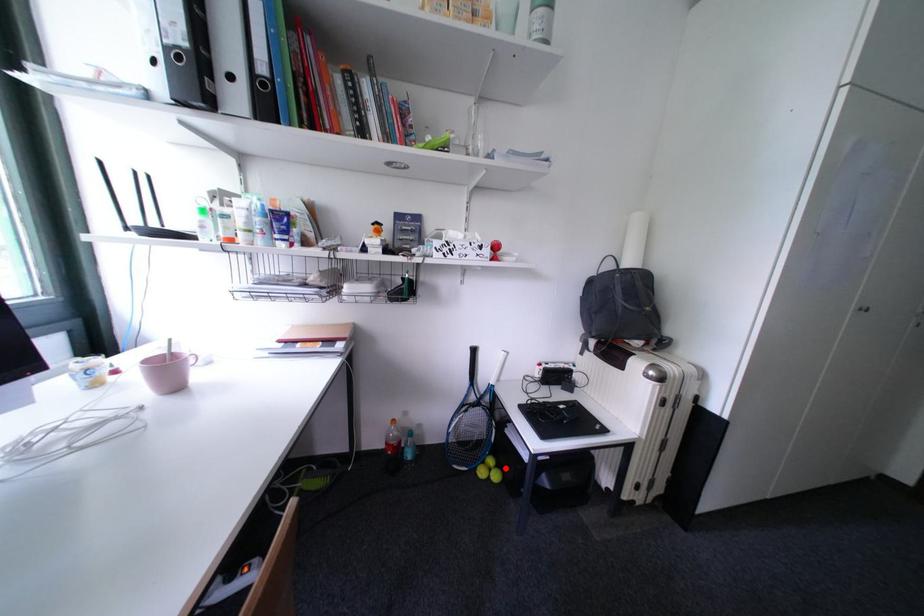
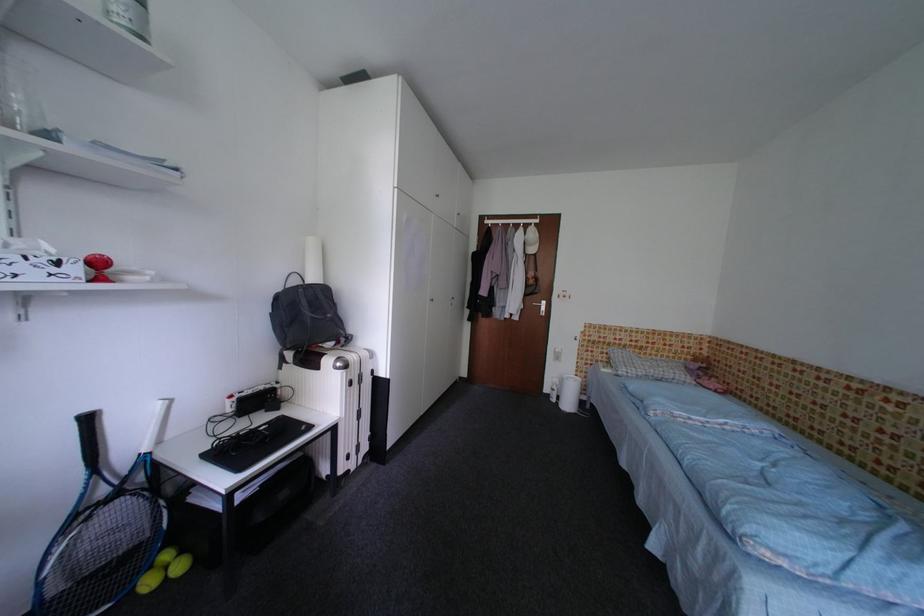
Locate, in the second image, the point that corresponds to the highlighted location in the first image.

(189, 554)